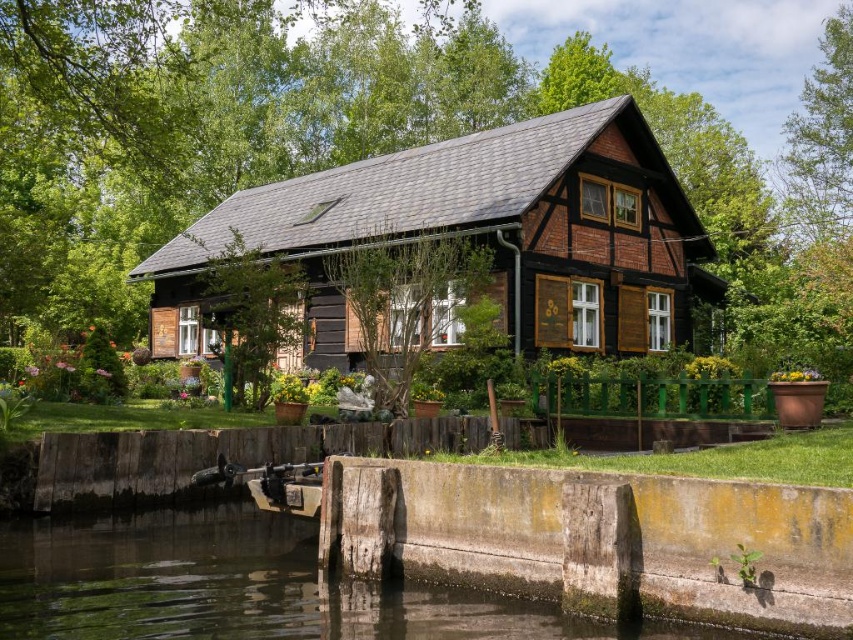
Which is below, smooth concrete wall at lower center or green leafy tree at upper right?

smooth concrete wall at lower center is lower down.

Consider the image. Between smooth concrete wall at lower center and green leafy tree at upper right, which one is positioned higher?

green leafy tree at upper right is above.

Who is more forward, (287, 592) or (850, 76)?

Positioned in front is point (287, 592).

Where is `smooth concrete wall at lower center`? This screenshot has height=640, width=853. smooth concrete wall at lower center is located at coordinates (247, 588).

Which is behind, point (593, 200) or point (795, 224)?

The point (795, 224) is behind.

Can you confirm if black wooden cabin at center is positioned above green leafy tree at upper right?

Actually, black wooden cabin at center is below green leafy tree at upper right.

The image size is (853, 640). What are the coordinates of `black wooden cabin at center` in the screenshot? It's located at (477, 234).

I want to click on black wooden cabin at center, so click(477, 234).

Who is taller, black wooden cabin at center or smooth concrete wall at lower center?

Standing taller between the two is black wooden cabin at center.

Which is in front, point (440, 324) or point (48, 532)?

Positioned in front is point (48, 532).

In order to click on black wooden cabin at center in this screenshot , I will do `click(477, 234)`.